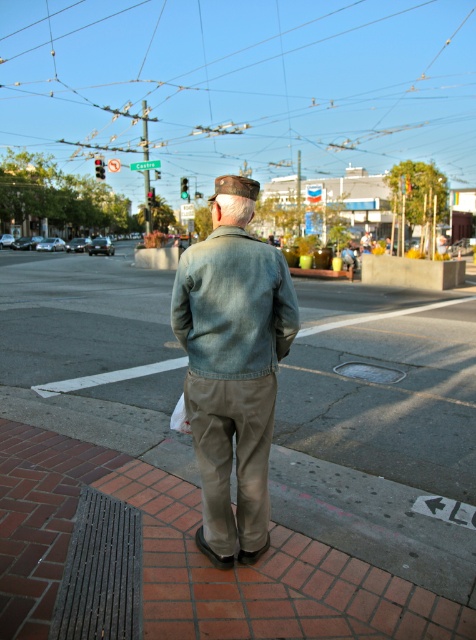
Question: Which of the following is the closest to the observer?

Choices:
 (A) (162, 426)
 (B) (253, 548)
 (C) (231, 328)

Answer: (C)

Question: Can you confirm if denim jacket at center is thinner than faded denim jacket at lower right?

Choices:
 (A) no
 (B) yes

Answer: (B)

Question: Among these objects, which one is nearest to the camera?

Choices:
 (A) denim jacket at center
 (B) brown brick pavement at center
 (C) faded denim jacket at lower right

Answer: (C)

Question: Is denim jacket at center further to the viewer compared to faded denim jacket at lower right?

Choices:
 (A) yes
 (B) no

Answer: (A)

Question: Does brown brick pavement at center have a greater width compared to faded denim jacket at lower right?

Choices:
 (A) no
 (B) yes

Answer: (B)

Question: Which point is farther to the camera?

Choices:
 (A) denim jacket at center
 (B) brown brick pavement at center

Answer: (B)